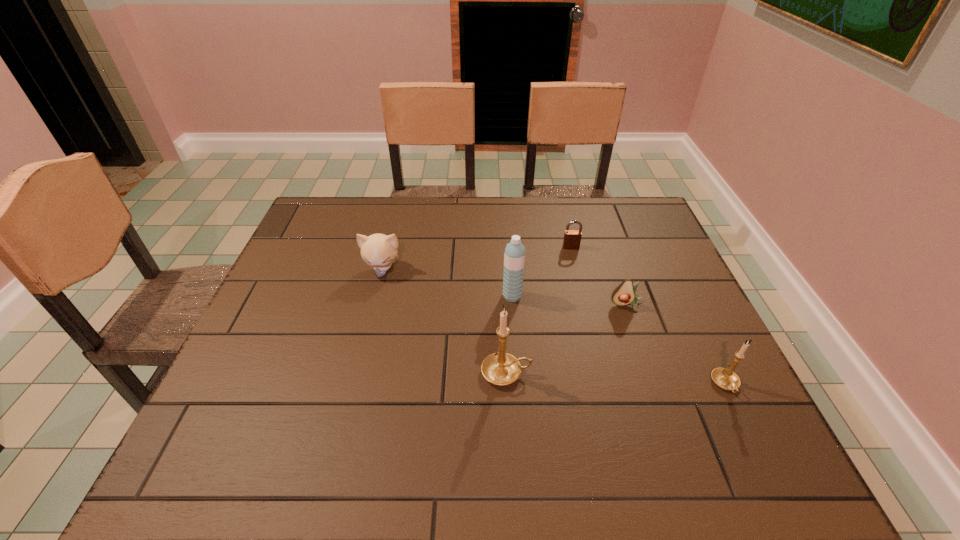
This screenshot has width=960, height=540. I want to click on vacant position at the left edge of the desktop, so click(x=251, y=386).

Find the location of a particular element. The image size is (960, 540). vacant region at the right edge of the desktop is located at coordinates (693, 382).

In order to click on free space at the near left corner of the desktop in this screenshot , I will do `click(256, 406)`.

This screenshot has height=540, width=960. Find the location of `free location at the far right corner of the desktop`. free location at the far right corner of the desktop is located at coordinates (632, 201).

Image resolution: width=960 pixels, height=540 pixels. What are the coordinates of `blank region between the water bottle and the left candle holder` in the screenshot? It's located at (510, 334).

Locate an element on the screen. The width and height of the screenshot is (960, 540). free point between the taller candle holder and the kitten is located at coordinates (444, 321).

You are a GUI agent. You are given a task and a screenshot of the screen. Output one action in this format:
    pyautogui.click(x=<x>, y=<y>)
    Task: Click on the free spot between the second farthest object and the padlock
    
    Given the screenshot: What is the action you would take?
    pyautogui.click(x=477, y=258)

Find the location of a particular element. This screenshot has height=540, width=960. free point between the shorter candle holder and the water bottle is located at coordinates (619, 340).

Find the location of `empty location between the left candle holder and the water bottle`. empty location between the left candle holder and the water bottle is located at coordinates (510, 334).

This screenshot has height=540, width=960. I want to click on empty space between the farthest object and the avocado, so click(599, 276).